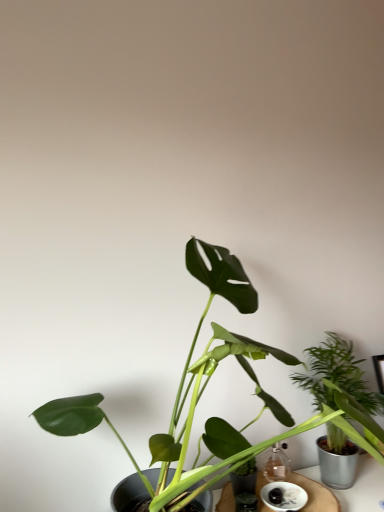
What do you see at coordinates (188, 384) in the screenshot? The width and height of the screenshot is (384, 512). I see `green matte leafy plant at center, marked as the first houseplant in a front-to-back arrangement` at bounding box center [188, 384].

Locate an element on the screen. The image size is (384, 512). green leafy plant at right, arranged as the 1th houseplant when viewed from the back is located at coordinates (339, 381).

This screenshot has height=512, width=384. What do you see at coordinates (339, 381) in the screenshot? I see `green leafy plant at right, which is the 2th houseplant in front-to-back order` at bounding box center [339, 381].

The width and height of the screenshot is (384, 512). What do you see at coordinates (283, 496) in the screenshot?
I see `white ceramic saucer at lower center` at bounding box center [283, 496].

Where is `wooden table at center`? wooden table at center is located at coordinates (316, 494).

Between green matte leafy plant at center, placed as the 2th houseplant when sorted from back to front, and wooden table at center, which one has less height?

Standing shorter between the two is wooden table at center.

Which is more to the left, green matte leafy plant at center, marked as the first houseplant in a front-to-back arrangement, or wooden table at center?

green matte leafy plant at center, marked as the first houseplant in a front-to-back arrangement.

Is green matte leafy plant at center, marked as the first houseplant in a front-to-back arrangement, next to wooden table at center?

No.

Does green matte leafy plant at center, placed as the 2th houseplant when sorted from back to front, turn towards wooden table at center?

No, green matte leafy plant at center, placed as the 2th houseplant when sorted from back to front, is not turned towards wooden table at center.

Is white ceramic saucer at lower center inside green leafy plant at right, arranged as the 1th houseplant when viewed from the back?

No, white ceramic saucer at lower center is located outside of green leafy plant at right, arranged as the 1th houseplant when viewed from the back.

Considering their positions, is green leafy plant at right, which is the 2th houseplant in front-to-back order, located in front of or behind white ceramic saucer at lower center?

In the image, green leafy plant at right, which is the 2th houseplant in front-to-back order, appears behind white ceramic saucer at lower center.

Is green leafy plant at right, which is the 2th houseplant in front-to-back order, next to white ceramic saucer at lower center?

No, green leafy plant at right, which is the 2th houseplant in front-to-back order, is not with white ceramic saucer at lower center.

Considering the sizes of objects green leafy plant at right, which is the 2th houseplant in front-to-back order, and white ceramic saucer at lower center in the image provided, who is taller, green leafy plant at right, which is the 2th houseplant in front-to-back order, or white ceramic saucer at lower center?

green leafy plant at right, which is the 2th houseplant in front-to-back order.

From a real-world perspective, is white ceramic saucer at lower center located beneath wooden table at center?

Actually, white ceramic saucer at lower center is physically above wooden table at center in the real world.

Can you confirm if white ceramic saucer at lower center is shorter than wooden table at center?

Indeed, white ceramic saucer at lower center has a lesser height compared to wooden table at center.

Consider the image. Is white ceramic saucer at lower center oriented towards wooden table at center?

No.

Is white ceramic saucer at lower center in contact with wooden table at center?

Yes, white ceramic saucer at lower center is next to wooden table at center.

Is point (342, 386) closer to camera compared to point (211, 257)?

That is False.

Is green leafy plant at right, arranged as the 1th houseplant when viewed from the back, facing towards green matte leafy plant at center, marked as the first houseplant in a front-to-back arrangement?

No, green leafy plant at right, arranged as the 1th houseplant when viewed from the back, is not turned towards green matte leafy plant at center, marked as the first houseplant in a front-to-back arrangement.

Which is more to the right, green leafy plant at right, arranged as the 1th houseplant when viewed from the back, or green matte leafy plant at center, marked as the first houseplant in a front-to-back arrangement?

Positioned to the right is green leafy plant at right, arranged as the 1th houseplant when viewed from the back.

Is the surface of green leafy plant at right, arranged as the 1th houseplant when viewed from the back, in direct contact with green matte leafy plant at center, marked as the first houseplant in a front-to-back arrangement?

No, green leafy plant at right, arranged as the 1th houseplant when viewed from the back, is not beside green matte leafy plant at center, marked as the first houseplant in a front-to-back arrangement.

From the image's perspective, count 1st houseplants upward from the wooden table at center and point to it. Please provide its 2D coordinates.

[(339, 381)]

Is point (323, 493) closer or farther from the camera than point (343, 452)?

Clearly, point (323, 493) is closer to the camera than point (343, 452).

Is wooden table at center in front of or behind green leafy plant at right, which is the 2th houseplant in front-to-back order, in the image?

wooden table at center is in front of green leafy plant at right, which is the 2th houseplant in front-to-back order.

Is wooden table at center to the right of green leafy plant at right, which is the 2th houseplant in front-to-back order, from the viewer's perspective?

Incorrect, wooden table at center is not on the right side of green leafy plant at right, which is the 2th houseplant in front-to-back order.

In terms of width, does wooden table at center look wider or thinner when compared to white ceramic saucer at lower center?

Answer: wooden table at center is wider than white ceramic saucer at lower center.

Find the location of a particular element. table that is in front of the white ceramic saucer at lower center is located at coordinates (316, 494).

Is wooden table at center not inside white ceramic saucer at lower center?

Yes.

Looking at this image, can you confirm if green matte leafy plant at center, placed as the 2th houseplant when sorted from back to front, is smaller than green leafy plant at right, arranged as the 1th houseplant when viewed from the back?

No, green matte leafy plant at center, placed as the 2th houseplant when sorted from back to front, is not smaller than green leafy plant at right, arranged as the 1th houseplant when viewed from the back.

You are a GUI agent. You are given a task and a screenshot of the screen. Output one action in this format:
    pyautogui.click(x=<x>, y=<y>)
    Task: Click on the houseplant below the green matte leafy plant at center, placed as the 2th houseplant when sorted from back to front (from the image's perspective)
    
    Given the screenshot: What is the action you would take?
    pyautogui.click(x=339, y=381)

Are green matte leafy plant at center, marked as the first houseplant in a front-to-back arrangement, and green leafy plant at right, arranged as the 1th houseplant when viewed from the back, making contact?

green matte leafy plant at center, marked as the first houseplant in a front-to-back arrangement, and green leafy plant at right, arranged as the 1th houseplant when viewed from the back, are clearly separated.

Is green leafy plant at right, which is the 2th houseplant in front-to-back order, a part of green matte leafy plant at center, placed as the 2th houseplant when sorted from back to front?

No.

The image size is (384, 512). What are the coordinates of `the 2nd houseplant above the wooden table at center (from the image's perspective)` in the screenshot? It's located at (188, 384).

At what (x,y) coordinates should I click in order to perform the action: click on houseplant located behind the white ceramic saucer at lower center. Please return your answer as a coordinate pair (x, y). The height and width of the screenshot is (512, 384). Looking at the image, I should click on (339, 381).

When comparing their distances from green matte leafy plant at center, placed as the 2th houseplant when sorted from back to front, does wooden table at center or white ceramic saucer at lower center seem closer?

Among the two, wooden table at center is located nearer to green matte leafy plant at center, placed as the 2th houseplant when sorted from back to front.

Based on their spatial positions, is green leafy plant at right, arranged as the 1th houseplant when viewed from the back, or green matte leafy plant at center, placed as the 2th houseplant when sorted from back to front, further from wooden table at center?

green matte leafy plant at center, placed as the 2th houseplant when sorted from back to front, is positioned further to the anchor wooden table at center.

Which object lies nearer to the anchor point green leafy plant at right, which is the 2th houseplant in front-to-back order, wooden table at center or green matte leafy plant at center, marked as the first houseplant in a front-to-back arrangement?

Among the two, green matte leafy plant at center, marked as the first houseplant in a front-to-back arrangement, is located nearer to green leafy plant at right, which is the 2th houseplant in front-to-back order.

From the image, which object appears to be nearer to green leafy plant at right, arranged as the 1th houseplant when viewed from the back, white ceramic saucer at lower center or wooden table at center?

Among the two, wooden table at center is located nearer to green leafy plant at right, arranged as the 1th houseplant when viewed from the back.

From the image, which object appears to be nearer to white ceramic saucer at lower center, green leafy plant at right, which is the 2th houseplant in front-to-back order, or wooden table at center?

wooden table at center is closer to white ceramic saucer at lower center.

Based on their spatial positions, is green leafy plant at right, which is the 2th houseplant in front-to-back order, or white ceramic saucer at lower center closer to wooden table at center?

Among the two, white ceramic saucer at lower center is located nearer to wooden table at center.

When comparing their distances from green matte leafy plant at center, placed as the 2th houseplant when sorted from back to front, does white ceramic saucer at lower center or green leafy plant at right, arranged as the 1th houseplant when viewed from the back, seem further?

Among the two, white ceramic saucer at lower center is located further to green matte leafy plant at center, placed as the 2th houseplant when sorted from back to front.

Considering their positions, is wooden table at center positioned further to green leafy plant at right, arranged as the 1th houseplant when viewed from the back, than white ceramic saucer at lower center?

Among the two, white ceramic saucer at lower center is located further to green leafy plant at right, arranged as the 1th houseplant when viewed from the back.

You are a GUI agent. You are given a task and a screenshot of the screen. Output one action in this format:
    pyautogui.click(x=<x>, y=<y>)
    Task: Click on the table positioned between green matte leafy plant at center, placed as the 2th houseplant when sorted from back to front, and green leafy plant at right, arranged as the 1th houseplant when viewed from the back, from near to far
    The height and width of the screenshot is (512, 384).
    Given the screenshot: What is the action you would take?
    pyautogui.click(x=316, y=494)

Locate an element on the screen. The height and width of the screenshot is (512, 384). saucer between green leafy plant at right, arranged as the 1th houseplant when viewed from the back, and wooden table at center in the up-down direction is located at coordinates (283, 496).

The width and height of the screenshot is (384, 512). What are the coordinates of `table located between green matte leafy plant at center, marked as the first houseplant in a front-to-back arrangement, and white ceramic saucer at lower center in the depth direction` in the screenshot? It's located at (316, 494).

Identify the location of saucer between green matte leafy plant at center, marked as the first houseplant in a front-to-back arrangement, and green leafy plant at right, which is the 2th houseplant in front-to-back order, in the front-back direction. (283, 496).